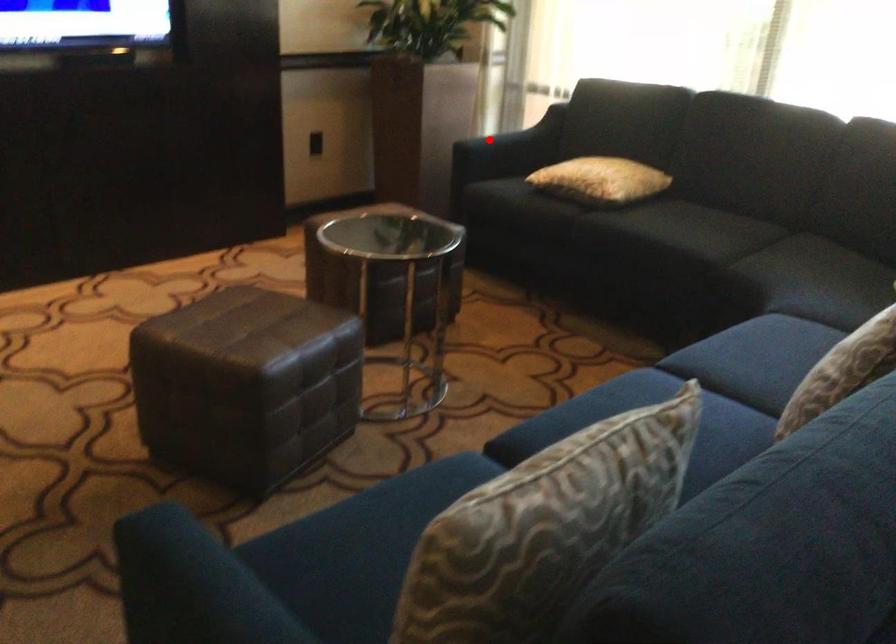
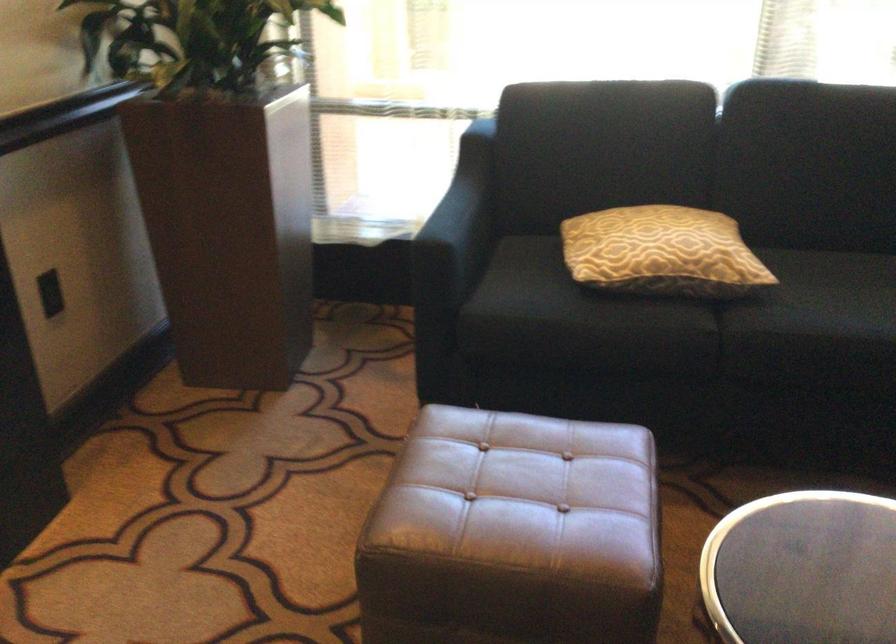
In the second image, find the point that corresponds to the highlighted location in the first image.

(458, 225)